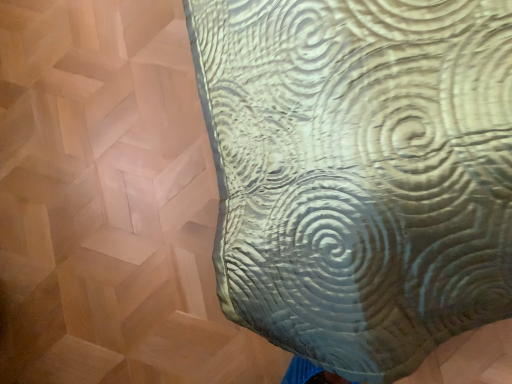
Find the location of a particular element. metallic quilt at upper right is located at coordinates (359, 173).

This screenshot has height=384, width=512. What do you see at coordinates (359, 173) in the screenshot? I see `metallic quilt at upper right` at bounding box center [359, 173].

The image size is (512, 384). Identify the location of metallic quilt at upper right. [359, 173].